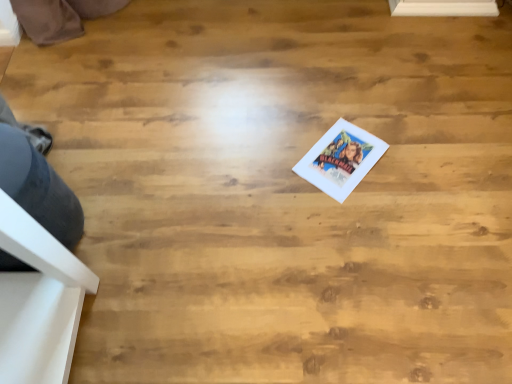
In order to click on free space between gray fabric shoe at lower left and matte paper postcard at center in this screenshot , I will do `click(206, 192)`.